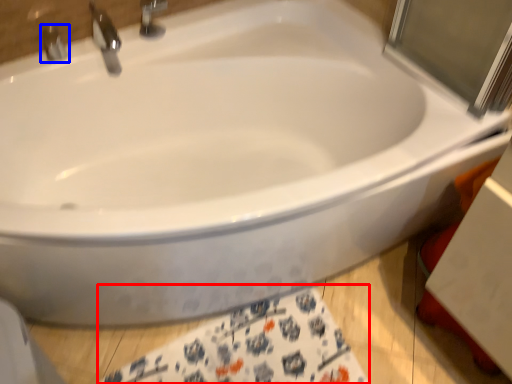
Question: Among these objects, which one is nearest to the camera, bath towel (highlighted by a red box) or tap (highlighted by a blue box)?

Choices:
 (A) bath towel
 (B) tap

Answer: (A)